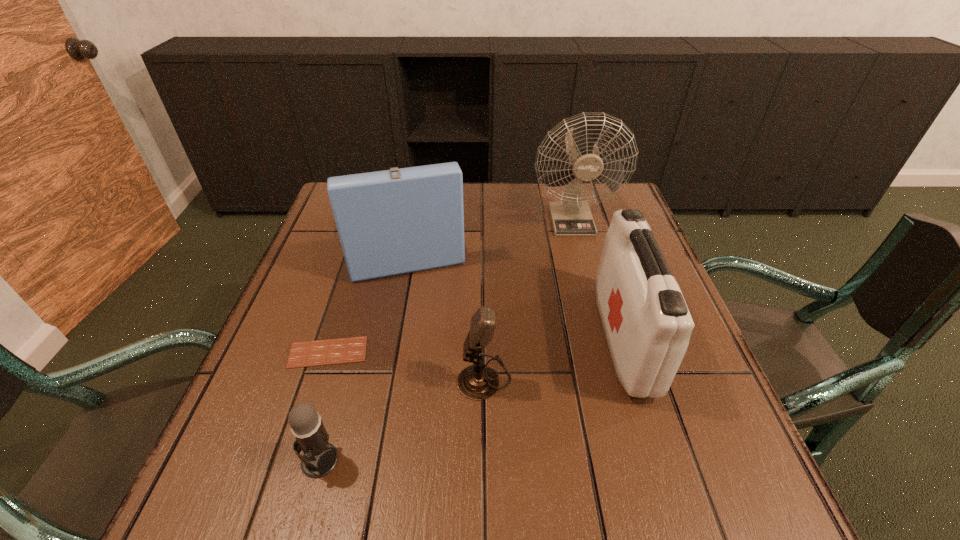
Locate an element on the screen. the tallest object is located at coordinates (572, 217).

This screenshot has height=540, width=960. Identify the location of phonograph record. (397, 221).

This screenshot has width=960, height=540. What are the coordinates of `the first-aid kit` in the screenshot? It's located at (647, 324).

Find the location of `the taller microphone`. the taller microphone is located at coordinates (479, 382).

Where is `the right microphone`? the right microphone is located at coordinates (479, 382).

The image size is (960, 540). Identify the location of the left microphone. (x=320, y=457).

The height and width of the screenshot is (540, 960). Find the location of `the nearest object`. the nearest object is located at coordinates (320, 457).

I want to click on the shortest object, so click(353, 349).

In order to click on free space located 0.050m on the air flow direction of the fan in this screenshot , I will do `click(579, 249)`.

This screenshot has width=960, height=540. In order to click on free region located on the back of the phonograph record in this screenshot , I will do `click(414, 183)`.